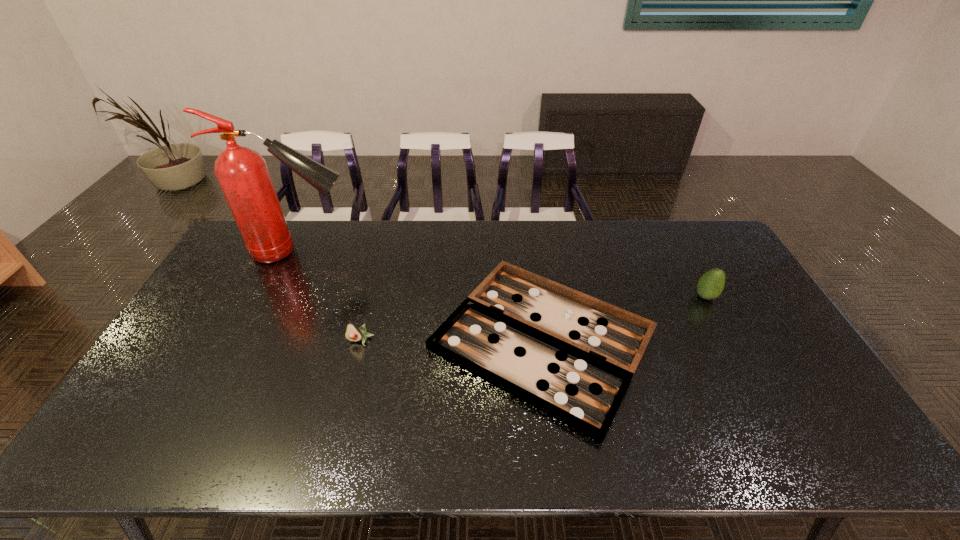
This screenshot has height=540, width=960. Find the location of `the tallest object`. the tallest object is located at coordinates (242, 173).

Locate an element on the screen. This screenshot has width=960, height=540. the leftmost object is located at coordinates (242, 173).

The width and height of the screenshot is (960, 540). Identify the location of the right avocado. (710, 285).

Locate an element on the screen. the second tallest object is located at coordinates (710, 285).

You are a GUI agent. You are given a task and a screenshot of the screen. Output one action in this format:
    pyautogui.click(x=<x>, y=<y>)
    Task: Click on the shorter avocado
    The height and width of the screenshot is (540, 960).
    Given the screenshot: What is the action you would take?
    pyautogui.click(x=353, y=333)

The image size is (960, 540). Find the location of `the third object from right to left`. the third object from right to left is located at coordinates (353, 333).

The height and width of the screenshot is (540, 960). What are the coordinates of `gameboard` in the screenshot? It's located at (572, 356).

Identify the location of the third object from left to right. (572, 356).

The height and width of the screenshot is (540, 960). What are the coordinates of `vacant area situated at the nozzle end of the tallest object` in the screenshot? It's located at (391, 252).

This screenshot has width=960, height=540. Find the location of `vacant space located 0.250m on the left of the second tallest object`. vacant space located 0.250m on the left of the second tallest object is located at coordinates (615, 296).